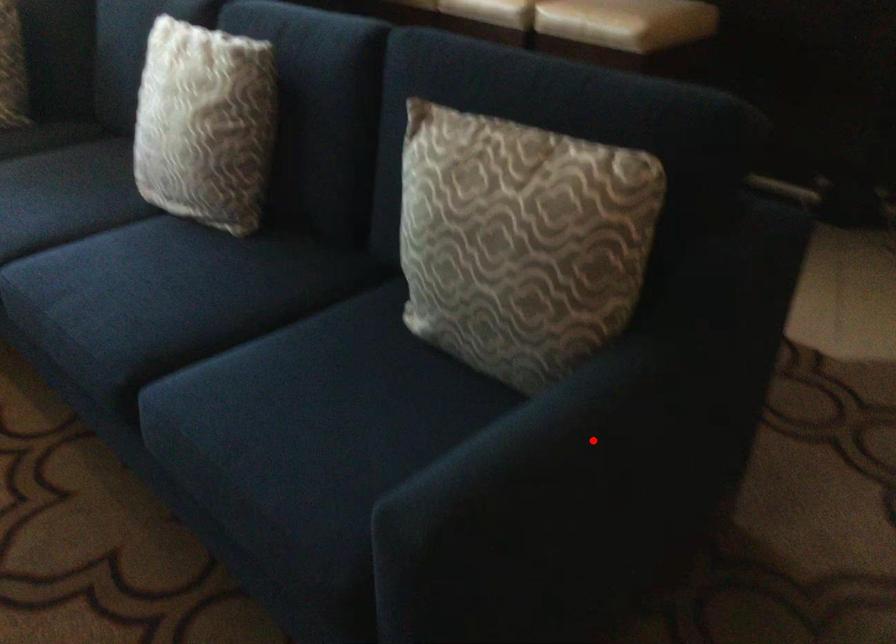
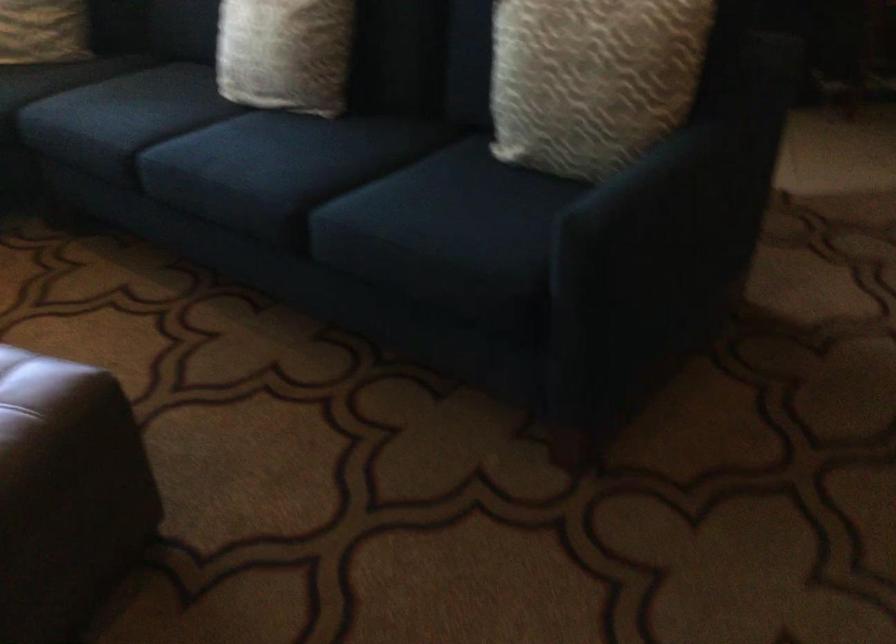
Locate, in the second image, the point that corresponds to the highlighted location in the first image.

(687, 190)